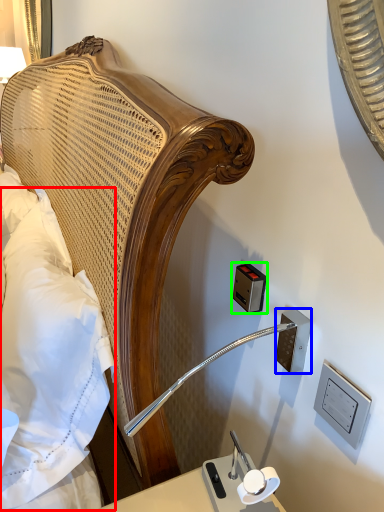
Question: Which object is positioned closest to pillow (highlighted by a red box)? Select from electric outlet (highlighted by a blue box) and electric outlet (highlighted by a green box).

Choices:
 (A) electric outlet
 (B) electric outlet

Answer: (B)